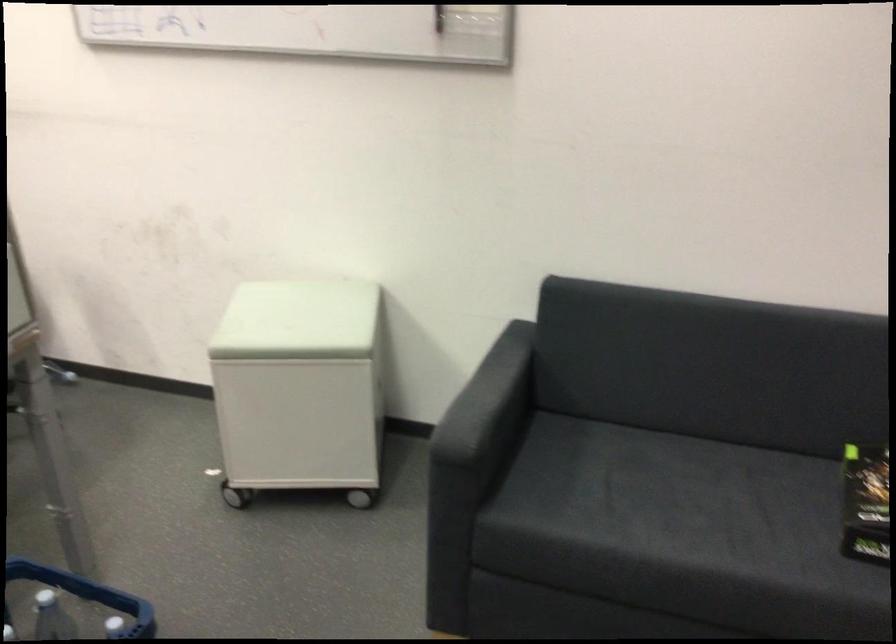
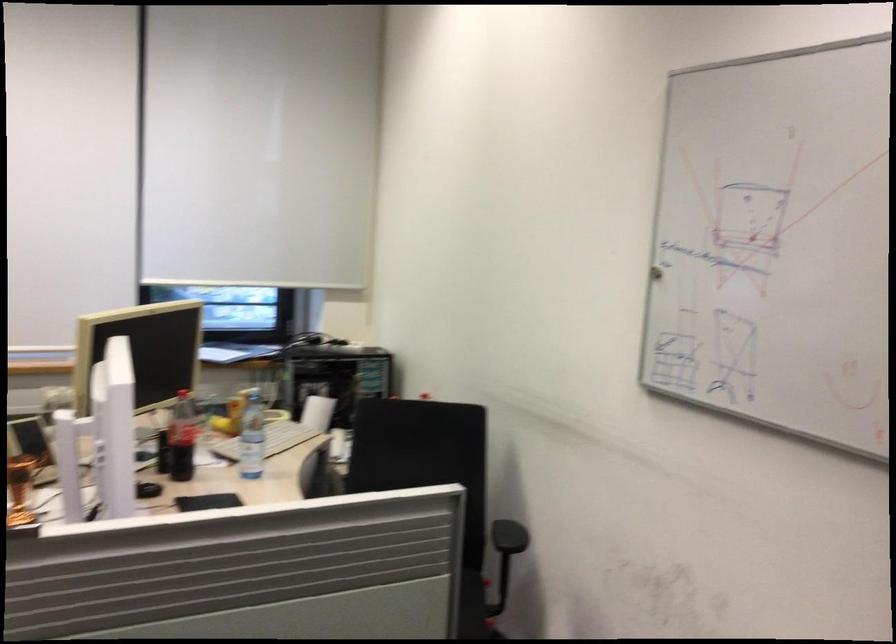
Question: Based on the continuous images, in which direction is the camera rotating? Reply with the corresponding letter.

Choices:
 (A) Left
 (B) Right
 (C) Up
 (D) Down

Answer: (A)